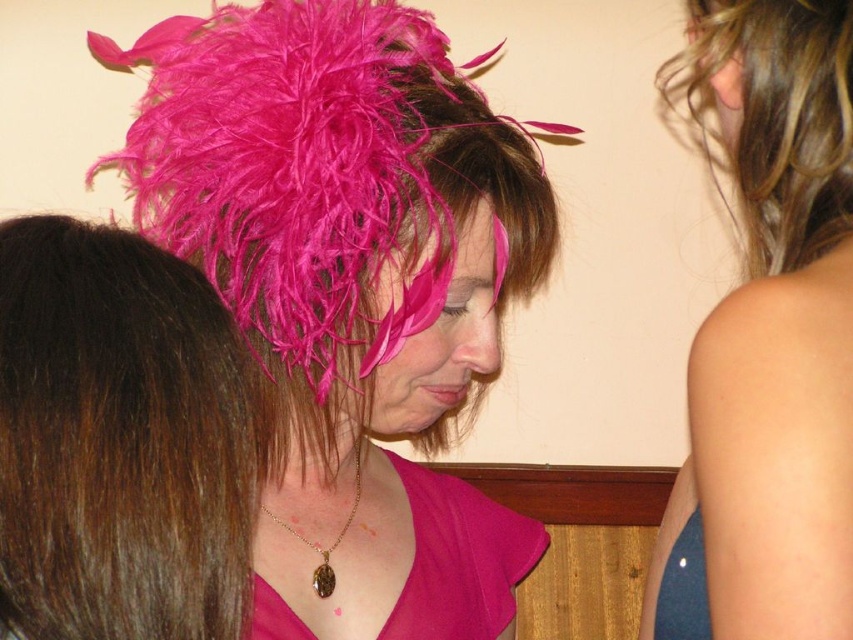
Question: Which point is closer to the camera?

Choices:
 (A) (326, 262)
 (B) (766, 454)
 (C) (113, 384)

Answer: (C)

Question: Which of the following is the farthest from the observer?

Choices:
 (A) pink satin dress at center
 (B) blonde curly hair at upper right

Answer: (B)

Question: Does brown smooth hair at left appear over blonde curly hair at upper right?

Choices:
 (A) no
 (B) yes

Answer: (A)

Question: Does smooth blue dress at right appear over pink satin dress at center?

Choices:
 (A) no
 (B) yes

Answer: (B)

Question: Does smooth blue dress at right appear under brown smooth hair at left?

Choices:
 (A) no
 (B) yes

Answer: (A)

Question: Which point is farther from the camera taking this photo?

Choices:
 (A) (64, 355)
 (B) (467, 636)
 (C) (813, 268)

Answer: (B)